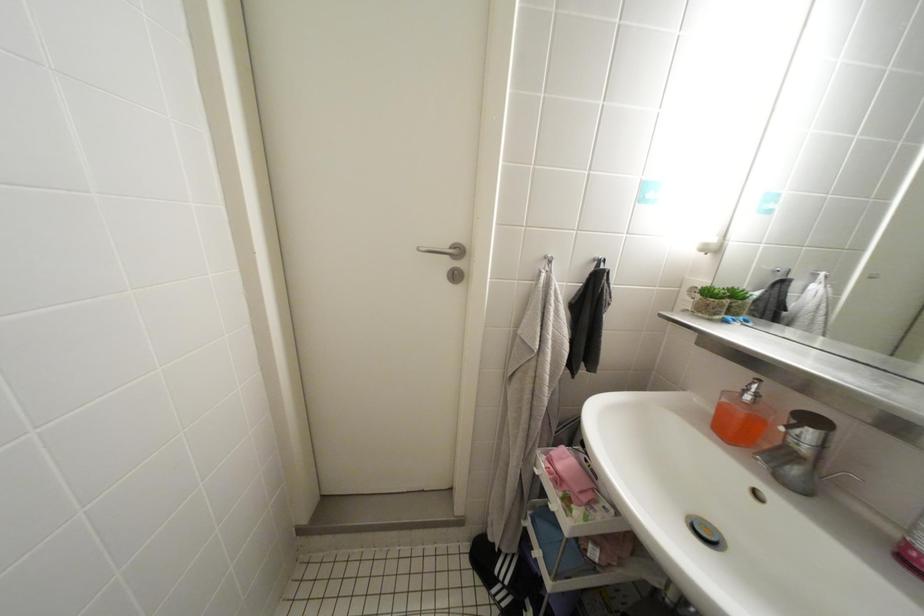
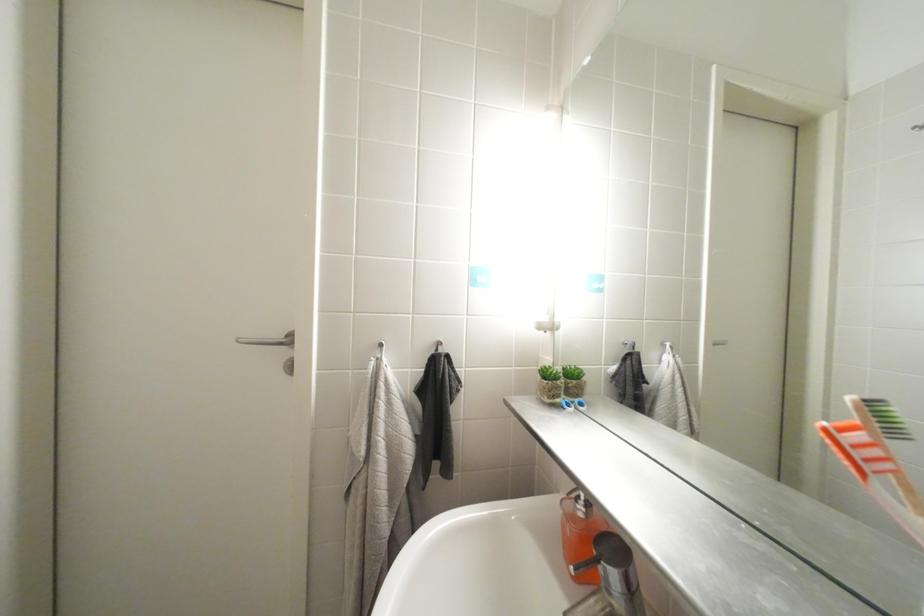
Question: How did the camera likely rotate?

Choices:
 (A) Left
 (B) Right
 (C) Up
 (D) Down

Answer: (C)